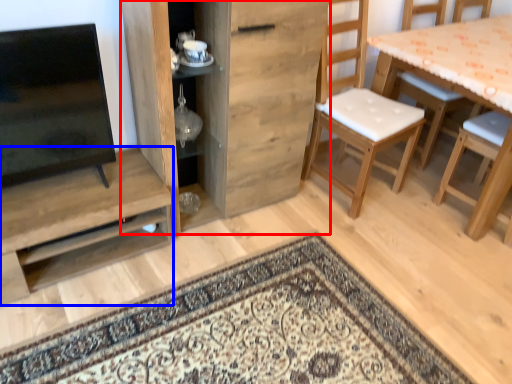
Question: Which of the following is the closest to the observer, cabinetry (highlighted by a red box) or shelf (highlighted by a blue box)?

Choices:
 (A) cabinetry
 (B) shelf

Answer: (A)